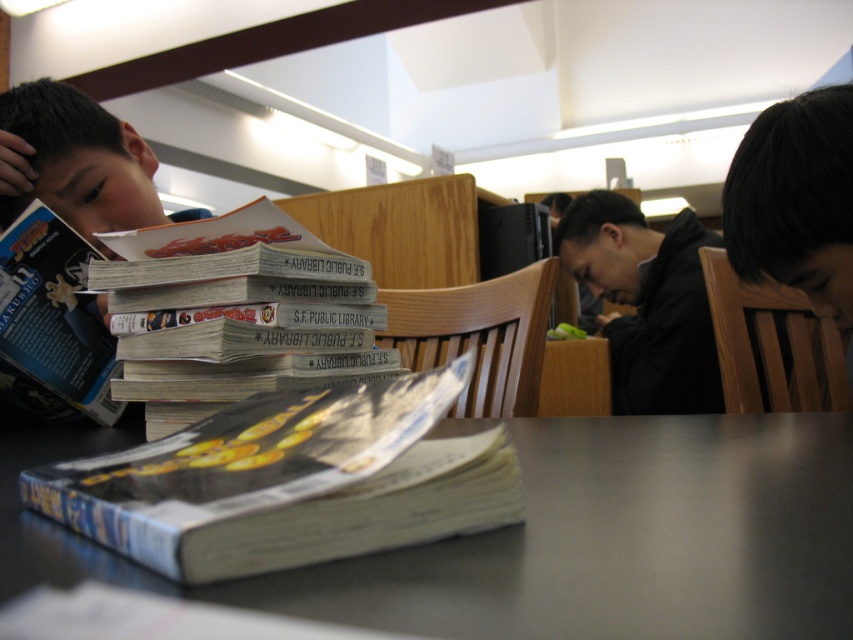
Does white glossy book at center appear under black matte jacket at center?

Yes.

Between point (206, 388) and point (682, 330), which one is positioned behind?

The point (682, 330) is behind.

Is point (126, 388) closer to viewer compared to point (671, 316)?

Yes.

Locate an element on the screen. white glossy book at center is located at coordinates (241, 321).

Looking at this image, does smooth gray table at lower center have a lesser width compared to white glossy book at center?

In fact, smooth gray table at lower center might be wider than white glossy book at center.

Looking at this image, does smooth gray table at lower center have a lesser height compared to white glossy book at center?

Yes.

Locate an element on the screen. The image size is (853, 640). smooth gray table at lower center is located at coordinates (553, 538).

Does smooth gray table at lower center come in front of matte black book at left?

Yes, it is.

Between smooth gray table at lower center and matte black book at left, which one is positioned lower?

smooth gray table at lower center is below.

Which is in front, point (827, 456) or point (80, 262)?

Point (827, 456) is more forward.

The image size is (853, 640). I want to click on smooth gray table at lower center, so click(553, 538).